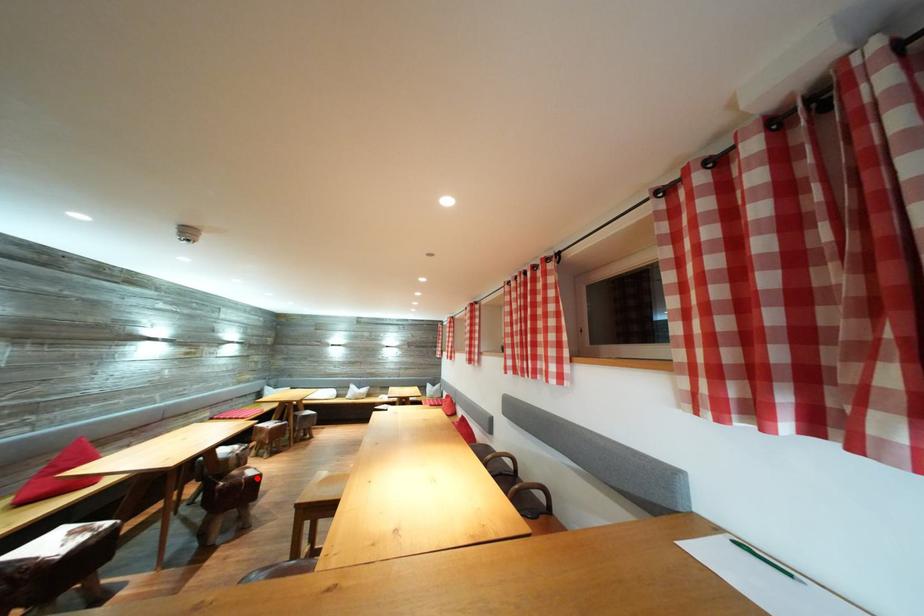
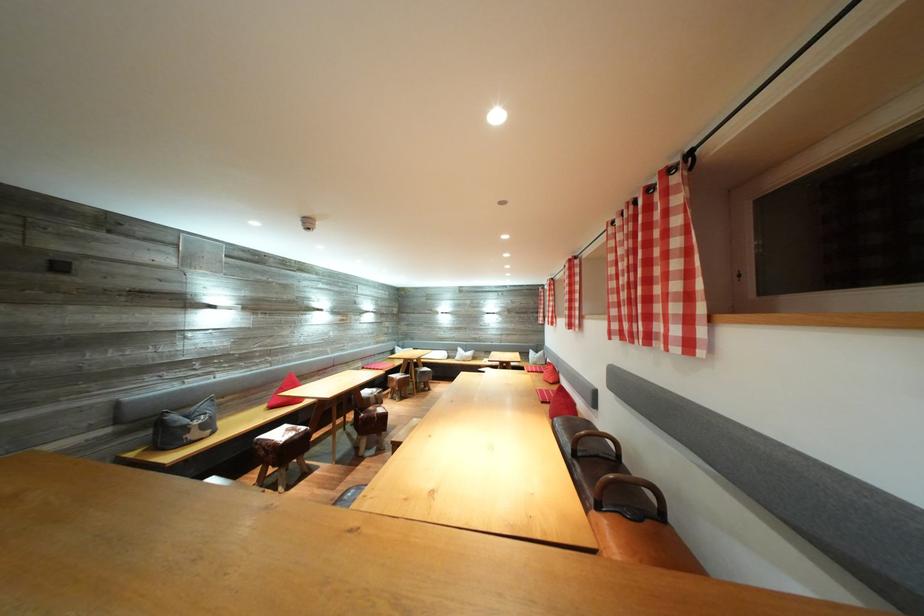
Locate, in the second image, the point that corresponds to the highlighted location in the first image.

(386, 416)